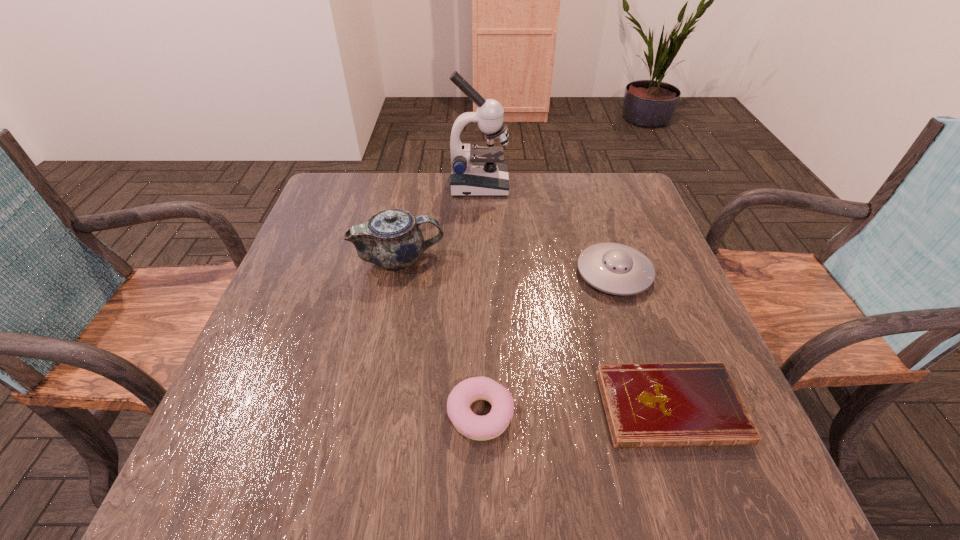
Where is `microscope`? This screenshot has width=960, height=540. microscope is located at coordinates (478, 171).

Find the location of a particular element. The height and width of the screenshot is (540, 960). the farthest object is located at coordinates (478, 171).

Identify the location of chinaware. The image size is (960, 540). (391, 239).

This screenshot has height=540, width=960. In order to click on the third shortest object in this screenshot , I will do `click(614, 268)`.

In order to click on the second shortest object in this screenshot , I will do `click(475, 427)`.

What are the coordinates of `the shortest object` in the screenshot? It's located at (689, 404).

Identify the location of vacant position located 0.180m at the eyepiece of the farthest object. The width and height of the screenshot is (960, 540). (568, 185).

Identify the location of vacant region located 0.060m from the spout of the chinaware. (468, 259).

Locate an element on the screen. Image resolution: width=960 pixels, height=540 pixels. free space located 0.370m on the left of the saucer is located at coordinates (420, 273).

At what (x,y) coordinates should I click in order to perform the action: click on free point located on the back of the second shortest object. Please return your answer as a coordinate pair (x, y). This screenshot has width=960, height=540. Looking at the image, I should click on (480, 263).